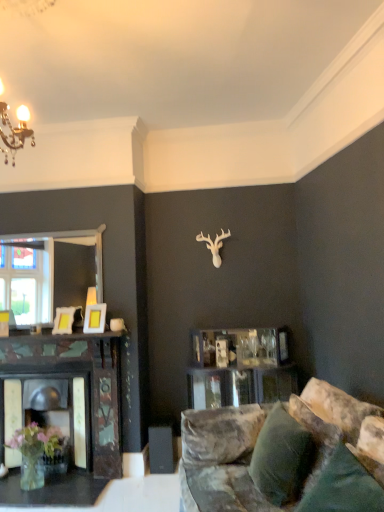
Question: Considering the positions of velvety green pillow at lower right, the second pillow from the back, and velvet green pillow at lower right, placed as the first pillow when sorted from back to front, in the image, is velvety green pillow at lower right, the second pillow from the back, wider or thinner than velvet green pillow at lower right, placed as the first pillow when sorted from back to front,?

Choices:
 (A) wide
 (B) thin

Answer: (B)

Question: From a real-world perspective, is velvety green pillow at lower right, the second pillow from the back, positioned above or below velvet green pillow at lower right, the second pillow in the front-to-back sequence?

Choices:
 (A) above
 (B) below

Answer: (A)

Question: Estimate the real-world distances between objects in this image. Which object is farther from the matte yellow picture frame at center, the second picture frame positioned from the left?

Choices:
 (A) clear glass vase at lower left
 (B) velvet green pillow at lower right, placed as the first pillow when sorted from back to front
 (C) velvety green pillow at lower right, arranged as the first pillow when viewed from the front
 (D) matte gold picture frame at left, the first picture frame when ordered from left to right

Answer: (C)

Question: Estimate the real-world distances between objects in this image. Which object is closer to the velvety green pillow at lower right, the second pillow from the back?

Choices:
 (A) matte gold picture frame at left, the first picture frame when ordered from left to right
 (B) velvet green pillow at lower right, the second pillow in the front-to-back sequence
 (C) clear glass vase at lower left
 (D) matte yellow picture frame at center, the second picture frame positioned from the left

Answer: (B)